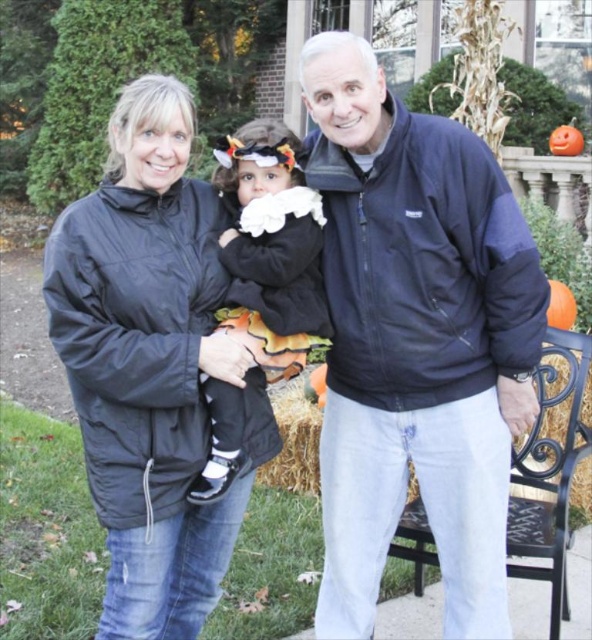
You are standing in the residential area shown in the image. There are two points marked in the scene. The first point is at coordinates point (571, 308) and the second point is at point (558, 145). Which point is closer to you as you face the image?

Point (571, 308) is in front of point (558, 145), so it is closer to you as you face the image.

Based on the scene description, which pumpkin is taller? The orange matte pumpkin at right or the orange matte pumpkin at upper right?

The orange matte pumpkin at upper right is taller than the orange matte pumpkin at right.